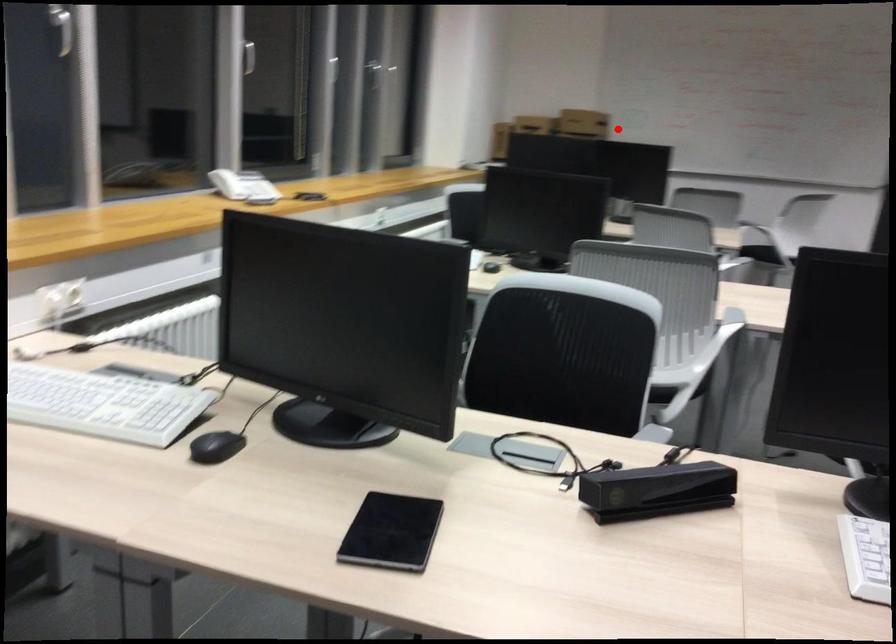
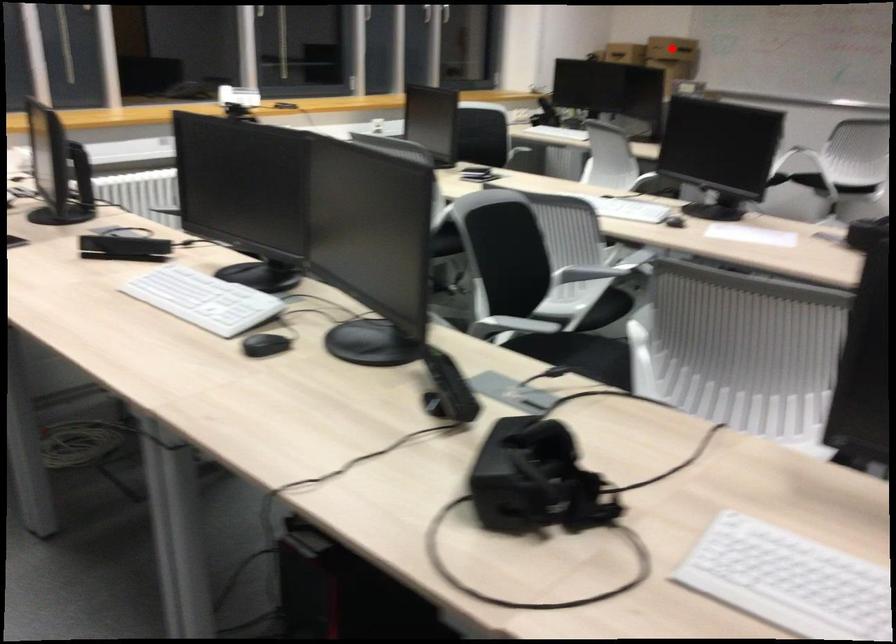
I am providing you with two images of the same scene from different viewpoints. A red point is marked on the first image and another point is marked on the second image. Is the red point in image1 aligned with the point shown in image2?

Yes